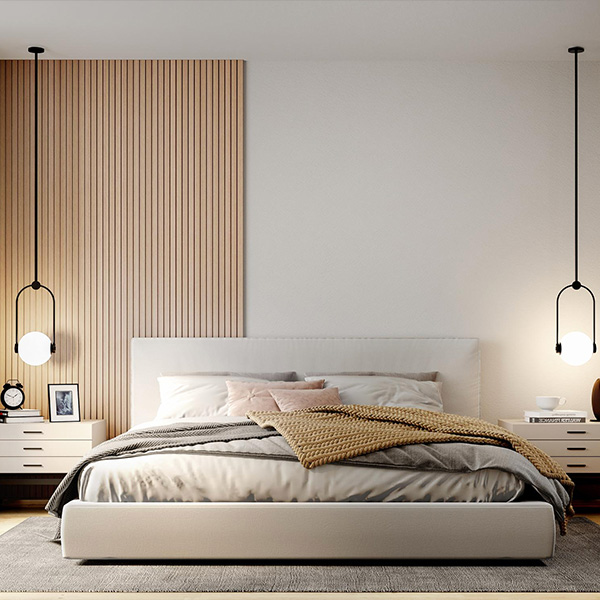
I want to click on book, so (x=548, y=417), (x=22, y=412), (x=13, y=421), (x=576, y=412).